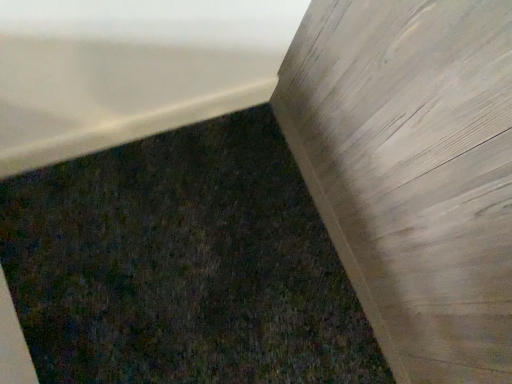
The image size is (512, 384). I want to click on white glossy bathtub at upper left, so click(x=129, y=69).

Describe the element at coordinates (129, 69) in the screenshot. I see `white glossy bathtub at upper left` at that location.

At what (x,y) coordinates should I click in order to perform the action: click on white glossy bathtub at upper left. Please return your answer as a coordinate pair (x, y). The image size is (512, 384). Looking at the image, I should click on (129, 69).